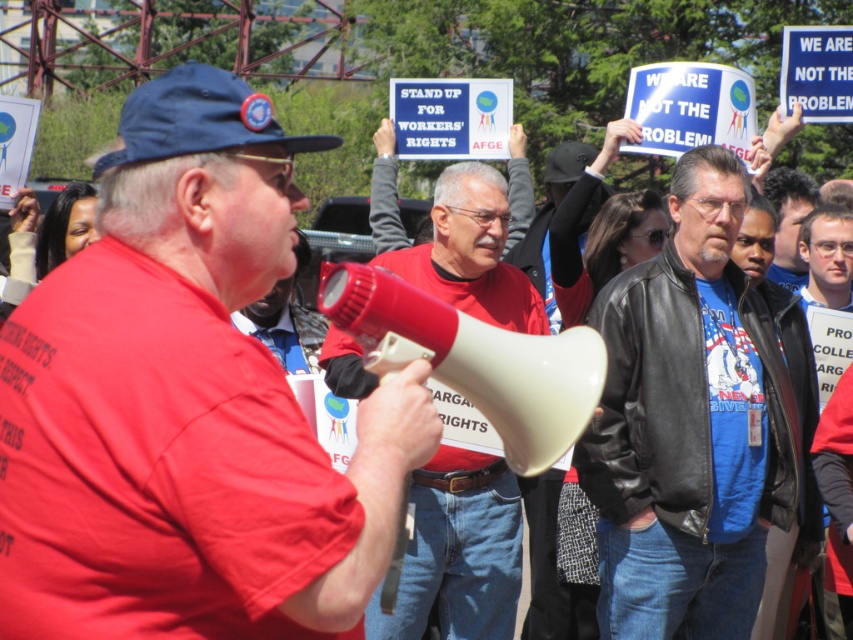
At what (x,y) coordinates should I click in order to perform the action: click on matte red shirt at center. Please return your answer as a coordinate pair (x, y). Looking at the image, I should click on (186, 404).

Who is more distant from viewer, (288, 253) or (508, 307)?

Point (508, 307)

At what (x,y) coordinates should I click in order to perform the action: click on matte red shirt at center. Please return your answer as a coordinate pair (x, y). The width and height of the screenshot is (853, 640). Looking at the image, I should click on (186, 404).

Is point (619, 362) positioned in front of point (465, 257)?

Yes, point (619, 362) is in front of point (465, 257).

Who is more forward, (683, 330) or (490, 547)?

Point (683, 330) is more forward.

The image size is (853, 640). I want to click on blue leather jacket at center, so click(695, 426).

Is matte red shirt at center to the left of blue leather jacket at center from the viewer's perspective?

Indeed, matte red shirt at center is positioned on the left side of blue leather jacket at center.

Find the location of `matte red shirt at center`. matte red shirt at center is located at coordinates (186, 404).

Identify the location of matte red shirt at center. The width and height of the screenshot is (853, 640). (186, 404).